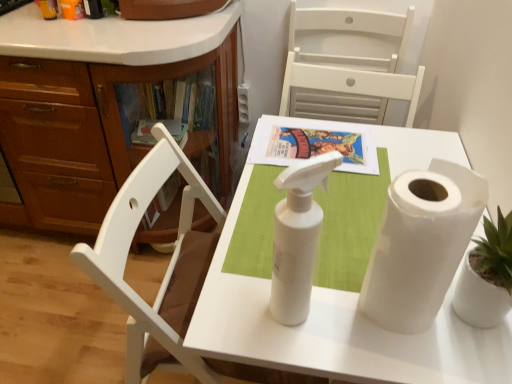
Locate an element on the screen. Image resolution: width=512 pixels, height=384 pixels. vacant location behind white matte spray bottle at center is located at coordinates (274, 241).